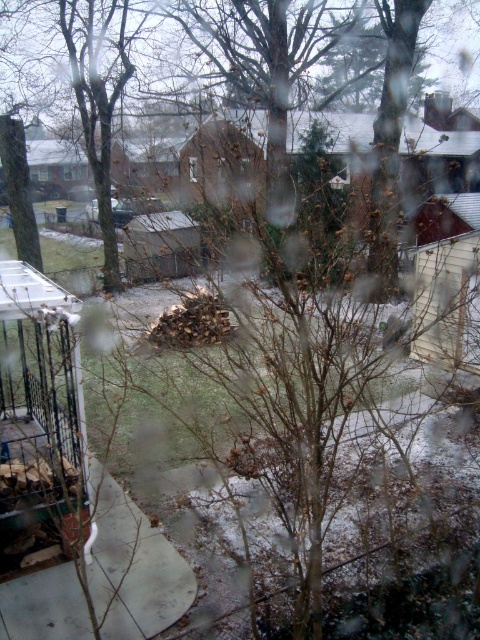
Question: Which point is farther from the camera taking this photo?

Choices:
 (A) click(x=192, y=180)
 (B) click(x=443, y=138)

Answer: (A)

Question: Which of the following is the closest to the observer?

Choices:
 (A) (194, 157)
 (B) (22, 45)

Answer: (B)

Question: Is brown leafless tree at center closer to camera compared to transparent glass window at center?

Choices:
 (A) no
 (B) yes

Answer: (B)

Question: Is brown leafless tree at center smaller than transparent glass window at center?

Choices:
 (A) yes
 (B) no

Answer: (B)

Question: Is brown leafless tree at center thinner than transparent glass window at center?

Choices:
 (A) yes
 (B) no

Answer: (B)